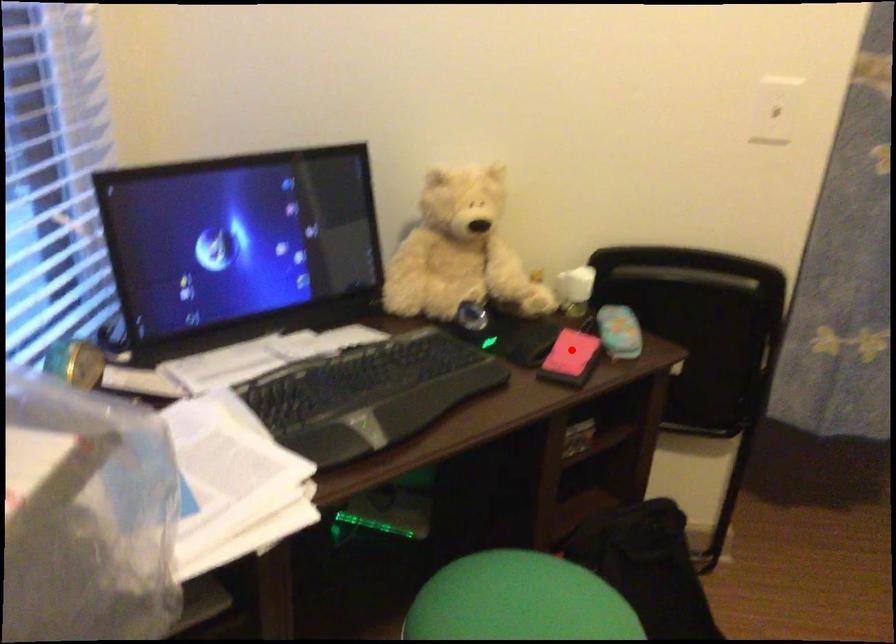
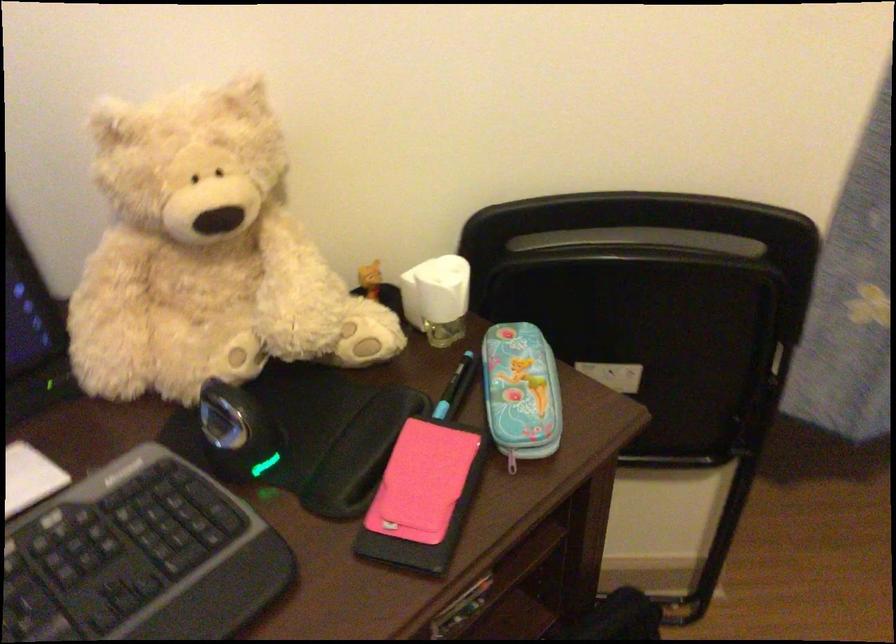
Where in the second image is the point corresponding to the highlighted location from the first image?

(421, 482)